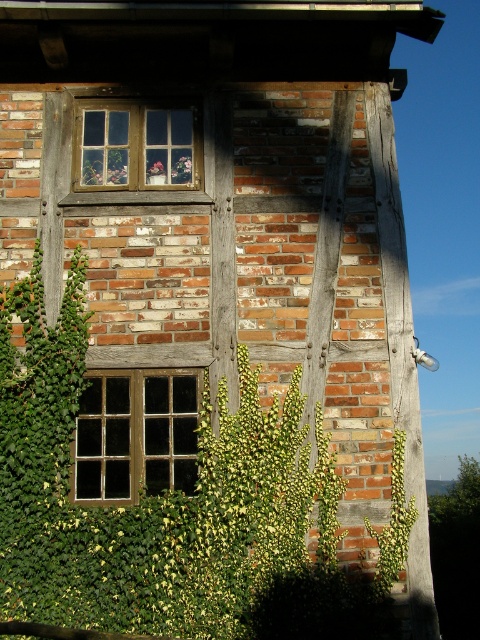
Which is in front, point (119, 445) or point (168, 129)?

Positioned in front is point (119, 445).

Who is shorter, wooden window at lower left or wooden frame at center?

With less height is wooden frame at center.

Describe the element at coordinates (135, 435) in the screenshot. The width and height of the screenshot is (480, 640). I see `wooden window at lower left` at that location.

This screenshot has height=640, width=480. I want to click on wooden window at lower left, so click(135, 435).

Can you confirm if wooden frame at center is positioned below green leafy plant at right?

Actually, wooden frame at center is above green leafy plant at right.

Is wooden frame at center wider than green leafy plant at right?

Yes.

Between point (121, 140) and point (382, 529), which one is positioned behind?

The point (121, 140) is behind.

I want to click on wooden frame at center, so click(x=135, y=147).

In the scene shown: Is wooden window at lower left above green leafy plant at right?

Indeed, wooden window at lower left is positioned over green leafy plant at right.

Is wooden window at lower left below green leafy plant at right?

No, wooden window at lower left is not below green leafy plant at right.

You are a GUI agent. You are given a task and a screenshot of the screen. Output one action in this format:
    pyautogui.click(x=<x>, y=<y>)
    Task: Click on the wooden window at lower left
    This screenshot has height=640, width=480.
    Given the screenshot: What is the action you would take?
    coord(135,435)